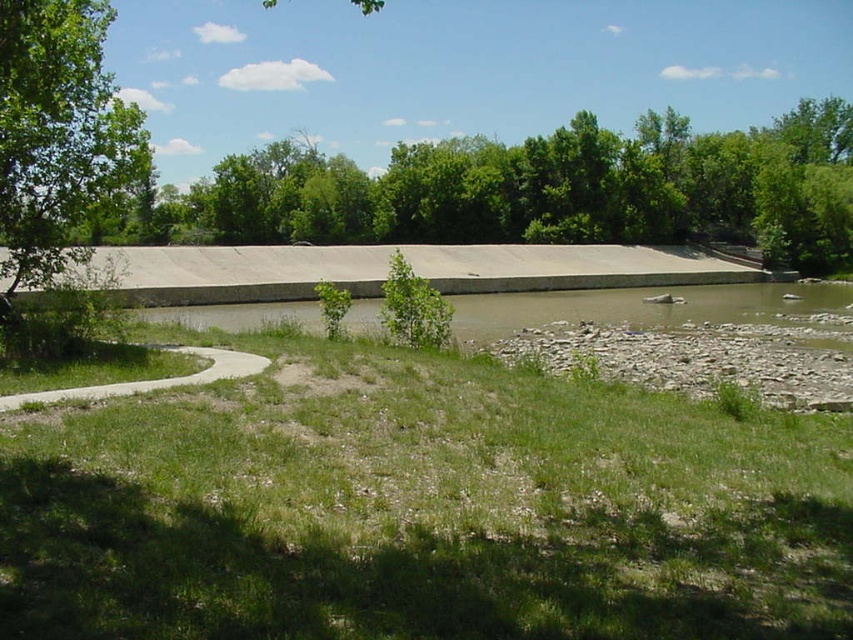
Between point (368, 531) and point (27, 77), which one is positioned behind?

The point (27, 77) is behind.

Is the position of green grass at lower center more distant than that of green leafy tree at upper left?

No.

Is point (691, 504) more distant than point (3, 36)?

No, (691, 504) is closer to viewer.

At what (x,y) coordinates should I click in order to perform the action: click on green grass at lower center. Please return your answer as a coordinate pair (x, y). This screenshot has width=853, height=640. Looking at the image, I should click on (421, 509).

Which is in front, point (67, 124) or point (76, 400)?

Point (76, 400)

Looking at this image, which is more to the left, green leafy tree at upper left or concrete at left?

Positioned to the left is green leafy tree at upper left.

You are a GUI agent. You are given a task and a screenshot of the screen. Output one action in this format:
    pyautogui.click(x=<x>, y=<y>)
    Task: Click on the green leafy tree at upper left
    
    Given the screenshot: What is the action you would take?
    pyautogui.click(x=57, y=132)

In the scene shown: Which of these two, green grass at lower center or concrete at left, stands shorter?

concrete at left

Between green grass at lower center and concrete at left, which one is positioned lower?

green grass at lower center

You are a GUI agent. You are given a task and a screenshot of the screen. Output one action in this format:
    pyautogui.click(x=<x>, y=<y>)
    Task: Click on the green grass at lower center
    The height and width of the screenshot is (640, 853).
    Given the screenshot: What is the action you would take?
    pyautogui.click(x=421, y=509)